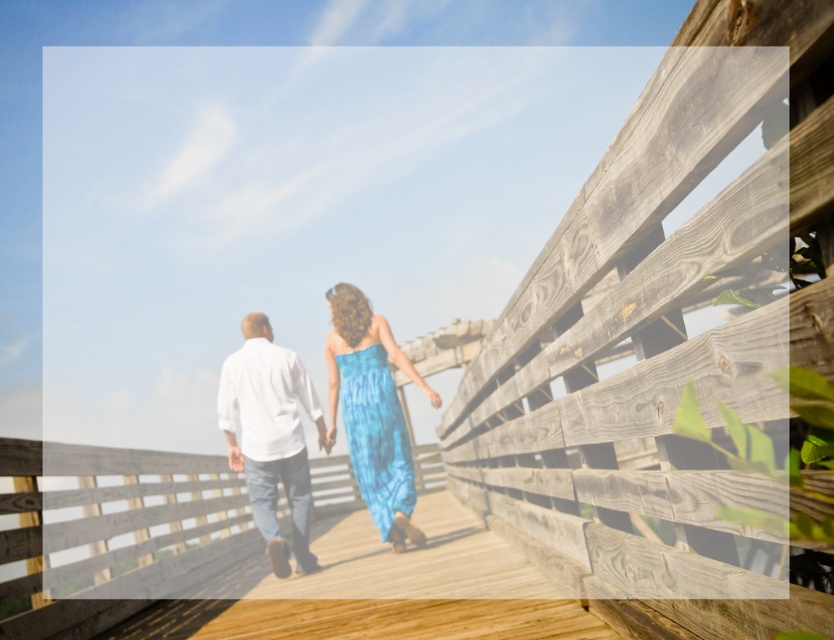
Question: Is blue silk dress at center above white cotton shirt at center?

Choices:
 (A) yes
 (B) no

Answer: (A)

Question: Which object appears closest to the camera in this image?

Choices:
 (A) blue tie-dye dress at center
 (B) blue silk dress at center
 (C) white cotton shirt at center

Answer: (A)

Question: Which point is farther to the camera?

Choices:
 (A) (284, 566)
 (B) (379, 406)

Answer: (A)

Question: Is white cotton shirt at center thinner than blue tie-dye dress at center?

Choices:
 (A) yes
 (B) no

Answer: (A)

Question: Which point is closer to the camera taking this photo?

Choices:
 (A) (302, 529)
 (B) (277, 548)

Answer: (B)

Question: From the image, what is the correct spatial relationship of blue silk dress at center in relation to blue tie-dye dress at center?

Choices:
 (A) right
 (B) left

Answer: (B)